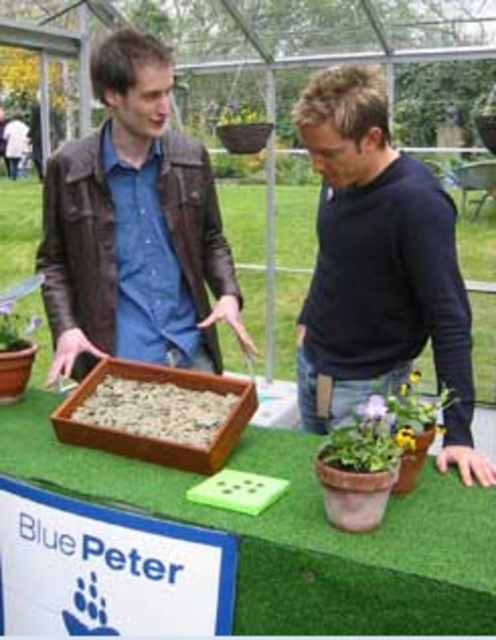
Question: Which point is farther to the camera?

Choices:
 (A) (379, 416)
 (B) (76, 467)

Answer: (B)

Question: Is wooden tray at center further to the viewer compared to black matte sweater at center?

Choices:
 (A) no
 (B) yes

Answer: (A)

Question: Which object is farther from the camera taking this photo?

Choices:
 (A) black matte sweater at center
 (B) green matte flower at center
 (C) brown textured soil at center
 (D) brown leather jacket at center

Answer: (D)

Question: Can you confirm if yellow matte flower at lower right is positioned below matte brown pot at lower center?

Choices:
 (A) no
 (B) yes

Answer: (B)

Question: Which point appears farthest from the camera in this image?

Choices:
 (A) (411, 380)
 (B) (345, 621)
 (C) (409, 428)
 (D) (217, 406)

Answer: (D)

Question: Does brown textured soil at center have a greater width compared to green matte flower at center?

Choices:
 (A) no
 (B) yes

Answer: (B)